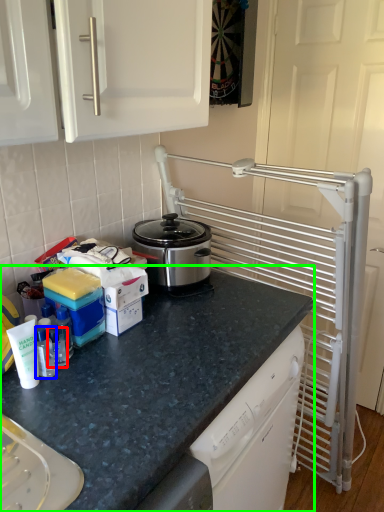
Question: Based on their relative distances, which object is farther from bottle (highlighted by a red box)? Choose from bottle (highlighted by a blue box) and countertop (highlighted by a green box).

Choices:
 (A) bottle
 (B) countertop

Answer: (B)